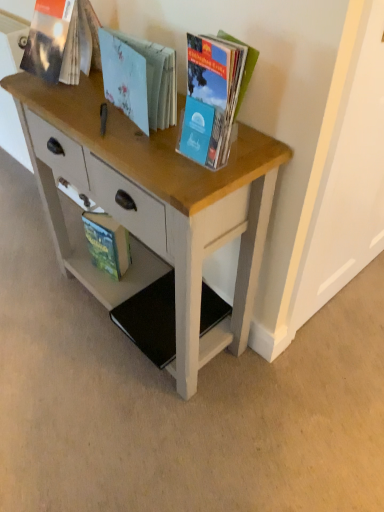
Where is `free space in front of matte plastic book at upper right, the first book in the front-to-back sequence`? This screenshot has height=512, width=384. free space in front of matte plastic book at upper right, the first book in the front-to-back sequence is located at coordinates (201, 181).